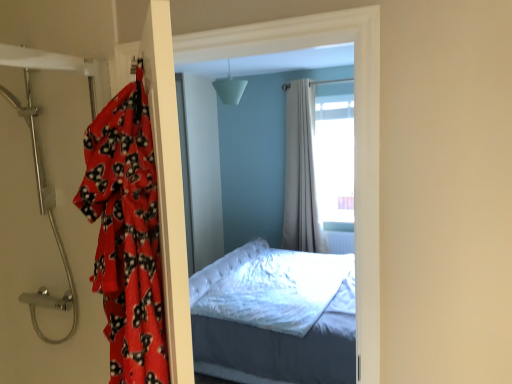
Question: Would you say fluffy red blanket at left is inside or outside beige fabric curtain at center?

Choices:
 (A) outside
 (B) inside

Answer: (A)

Question: Is fluffy red blanket at left in front of or behind beige fabric curtain at center in the image?

Choices:
 (A) front
 (B) behind

Answer: (A)

Question: Estimate the real-world distances between objects in this image. Which object is farther from the fluffy red blanket at left?

Choices:
 (A) beige fabric curtain at center
 (B) metallic showerhead at left

Answer: (A)

Question: Which of these objects is positioned closest to the metallic showerhead at left?

Choices:
 (A) beige fabric curtain at center
 (B) fluffy red blanket at left

Answer: (B)